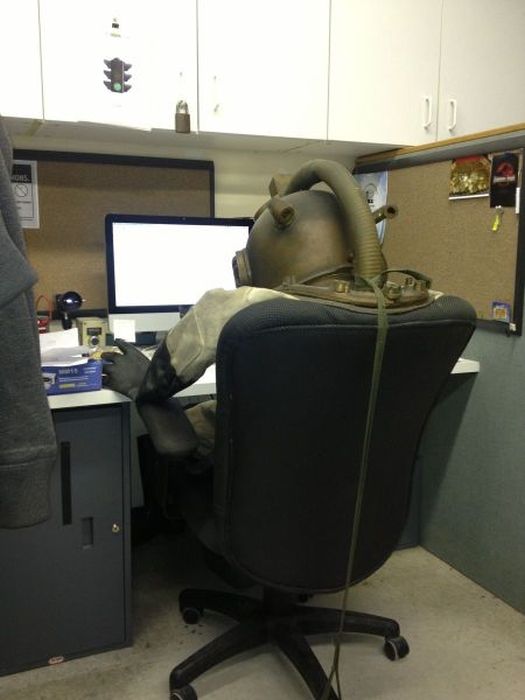
This screenshot has height=700, width=525. What are the coordinates of `arm rest of chair` in the screenshot? It's located at (174, 428).